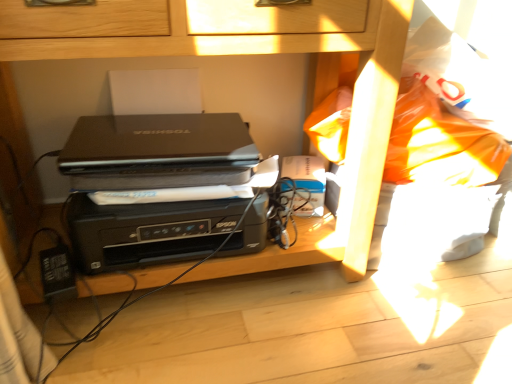
The image size is (512, 384). I want to click on black matte laptop at center, so 158,141.

You are a GUI agent. You are given a task and a screenshot of the screen. Output one action in this format:
    pyautogui.click(x=<x>, y=<y>)
    Task: Click on the black plastic printer at center
    Image resolution: width=512 pixels, height=384 pixels.
    Given the screenshot: What is the action you would take?
    pyautogui.click(x=153, y=186)

From a real-world perspective, does black plastic printer at center stand above matte black laptop at center?

Yes, from a real-world perspective, black plastic printer at center is over matte black laptop at center

From the image's perspective, is black plastic printer at center above matte black laptop at center?

Correct, black plastic printer at center appears higher than matte black laptop at center in the image.

Is black plastic printer at center oriented away from matte black laptop at center?

Result: Yes, black plastic printer at center's orientation is away from matte black laptop at center.

Is matte black laptop at center oriented away from black plastic printer at center?

No, matte black laptop at center is not facing away from black plastic printer at center.

The width and height of the screenshot is (512, 384). I want to click on printer below the matte black laptop at center (from the image's perspective), so click(153, 186).

Does matte black laptop at center appear on the right side of black plastic printer at center?

Incorrect, matte black laptop at center is not on the right side of black plastic printer at center.

Between matte black laptop at center and black plastic printer at center, which one has smaller size?

matte black laptop at center is smaller.

Considering the positions of objects matte black laptop at center and black plastic printer at center in the image provided, who is in front, matte black laptop at center or black plastic printer at center?

black plastic printer at center.

Looking at this image, what's the angular difference between matte black laptop at center and black plastic printer at center's facing directions?

They differ by 4.61 degrees in their facing directions.

From a real-world perspective, is matte black laptop at center physically located above or below black plastic printer at center?

matte black laptop at center is below black plastic printer at center.

Between matte black laptop at center and black plastic printer at center, which one has more height?

With more height is black plastic printer at center.

Does black plastic printer at center come behind black matte laptop at center?

That is False.

From the image's perspective, between black plastic printer at center and black matte laptop at center, which one is located above?

black matte laptop at center appears higher in the image.

Who is taller, black plastic printer at center or black matte laptop at center?

black plastic printer at center.

Can you confirm if black plastic printer at center is smaller than black matte laptop at center?

No, black plastic printer at center is not smaller than black matte laptop at center.

From the image's perspective, which one is positioned lower, black matte laptop at center or black plastic printer at center?

black plastic printer at center.

Can we say black matte laptop at center lies outside black plastic printer at center?

No, black matte laptop at center is not entirely external to black plastic printer at center.

Which of these two, black matte laptop at center or black plastic printer at center, stands shorter?

With less height is black matte laptop at center.

Is black matte laptop at center at the right side of black plastic printer at center?

Incorrect, black matte laptop at center is not on the right side of black plastic printer at center.

Does black plastic printer at center have a greater width compared to black plastic printer at center?

Indeed, black plastic printer at center has a greater width compared to black plastic printer at center.

Between black plastic printer at center and black plastic printer at center, which one is positioned behind?

Positioned behind is black plastic printer at center.

At what (x,y) coordinates should I click in order to perform the action: click on furniture above the black plastic printer at center (from the image's perspective). Please return your answer as a coordinate pair (x, y). Image resolution: width=512 pixels, height=384 pixels. Looking at the image, I should click on (264, 53).

Which object is positioned more to the left, black plastic printer at center or black plastic printer at center?

black plastic printer at center.

From a real-world perspective, is matte black laptop at center located beneath black matte laptop at center?

Indeed, from a real-world perspective, matte black laptop at center is positioned beneath black matte laptop at center.

Is point (233, 179) positioned before point (167, 148)?

Yes.

From the image's perspective, does matte black laptop at center appear lower than black matte laptop at center?

Yes.

Is matte black laptop at center wider than black matte laptop at center?

Incorrect, the width of matte black laptop at center does not surpass that of black matte laptop at center.

Where is `furniture in front of the matte black laptop at center`? This screenshot has height=384, width=512. furniture in front of the matte black laptop at center is located at coordinates (264, 53).

This screenshot has height=384, width=512. I want to click on paperback book above the black plastic printer at center (from the image's perspective), so click(x=179, y=177).

Considering their positions, is black plastic printer at center positioned closer to black matte laptop at center than matte black laptop at center?

Among the two, black plastic printer at center is located nearer to black matte laptop at center.

Estimate the real-world distances between objects in this image. Which object is closer to matte black laptop at center, black plastic printer at center or black matte laptop at center?

black matte laptop at center is closer to matte black laptop at center.

Consider the image. Which object lies further to the anchor point matte black laptop at center, black matte laptop at center or black plastic printer at center?

black matte laptop at center is further to matte black laptop at center.

Based on their spatial positions, is black plastic printer at center or black matte laptop at center closer to black plastic printer at center?

black plastic printer at center is positioned closer to the anchor black plastic printer at center.

Estimate the real-world distances between objects in this image. Which object is further from black plastic printer at center, matte black laptop at center or black plastic printer at center?

matte black laptop at center lies further to black plastic printer at center than the other object.

Which object lies nearer to the anchor point black matte laptop at center, matte black laptop at center or black plastic printer at center?

Based on the image, matte black laptop at center appears to be nearer to black matte laptop at center.

In the scene shown: Based on their spatial positions, is black plastic printer at center or black plastic printer at center further from matte black laptop at center?

Based on the image, black plastic printer at center appears to be further to matte black laptop at center.

Looking at the image, which one is located further to matte black laptop at center, black matte laptop at center or black plastic printer at center?

black plastic printer at center lies further to matte black laptop at center than the other object.

Find the location of a particular element. The height and width of the screenshot is (384, 512). printer between black plastic printer at center and matte black laptop at center along the z-axis is located at coordinates (153, 186).

Where is `laptop between black plastic printer at center and black plastic printer at center from front to back`? The height and width of the screenshot is (384, 512). laptop between black plastic printer at center and black plastic printer at center from front to back is located at coordinates (158, 141).

Identify the location of laptop positioned between black plastic printer at center and matte black laptop at center from near to far. (158, 141).

This screenshot has width=512, height=384. In order to click on paperback book between black matte laptop at center and black plastic printer at center vertically in this screenshot , I will do `click(179, 177)`.